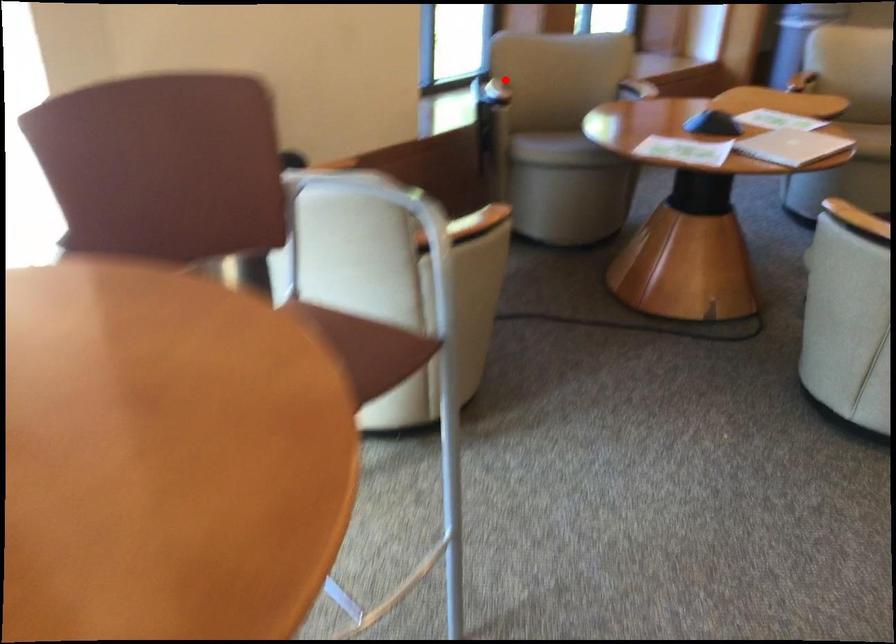
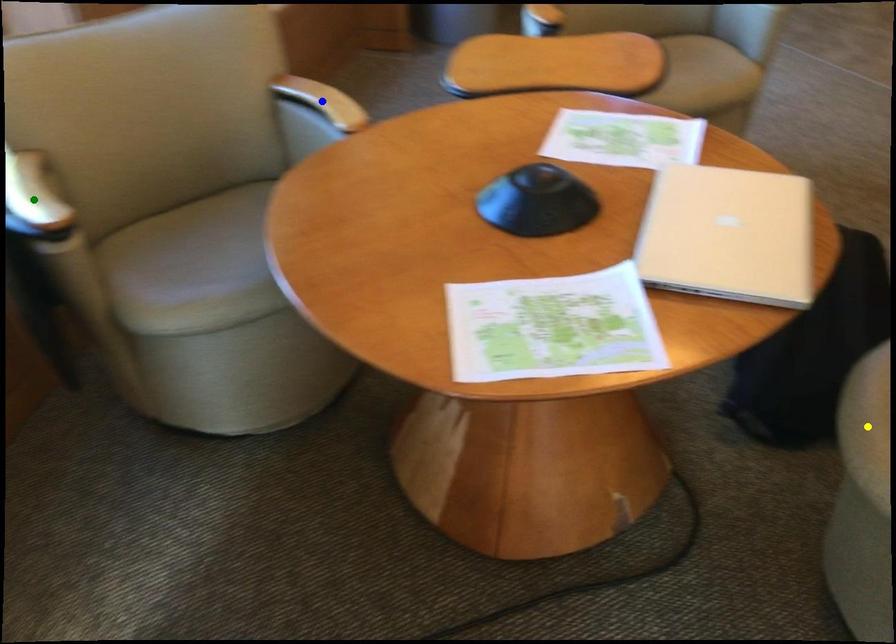
Question: I am providing you with two images of the same scene from different viewpoints. A red point is marked on the first image. You are given multiple points on the second image. Can you choose the point in image 2 that corresponds to the point in image 1?

Choices:
 (A) blue point
 (B) yellow point
 (C) green point

Answer: (C)